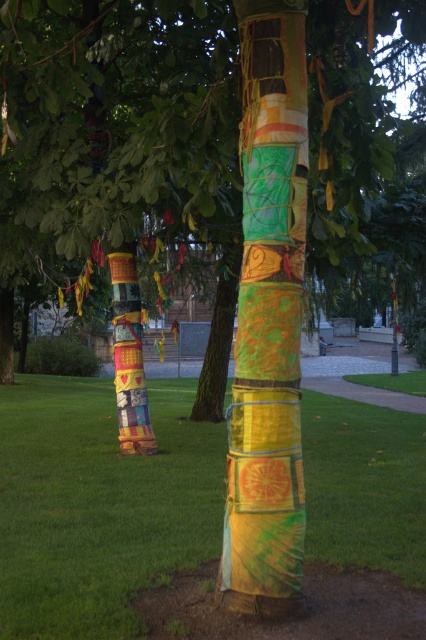
Which is below, textured fabric tree at center or green grass at lower center?

green grass at lower center

Is point (334, 48) in front of point (172, 452)?

Yes, it is.

I want to click on textured fabric tree at center, so click(114, 125).

This screenshot has height=640, width=426. Describe the element at coordinates (267, 320) in the screenshot. I see `textured fabric pillar at center` at that location.

Which is below, textured fabric pillar at center or multicolored fabric wrapped tree trunk at center?

textured fabric pillar at center is lower down.

Which is in front, point (282, 557) or point (129, 392)?

Positioned in front is point (282, 557).

You are a GUI agent. You are given a task and a screenshot of the screen. Output one action in this format:
    pyautogui.click(x=<x>, y=<y>)
    Task: Click on the textured fabric pillar at center
    
    Given the screenshot: What is the action you would take?
    pyautogui.click(x=267, y=320)

Between point (348, 237) and point (141, 358), which one is positioned behind?

Positioned behind is point (141, 358).

Is textured fabric tree at center bigger than multicolored fabric wrapped tree trunk at center?

No, textured fabric tree at center is not bigger than multicolored fabric wrapped tree trunk at center.

What do you see at coordinates (114, 125) in the screenshot?
I see `textured fabric tree at center` at bounding box center [114, 125].

Identify the location of textured fabric tree at center. This screenshot has height=640, width=426. (114, 125).